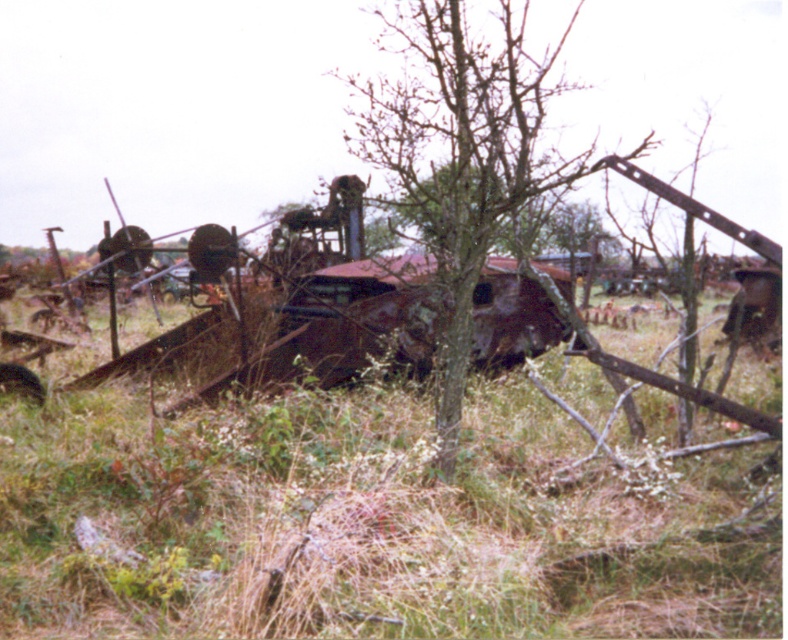
Is green grass at center taller than rusty metal train car at center?

No, green grass at center is not taller than rusty metal train car at center.

Who is more distant from viewer, (768, 621) or (348, 296)?

Point (348, 296)

What do you see at coordinates (363, 522) in the screenshot?
I see `green grass at center` at bounding box center [363, 522].

The width and height of the screenshot is (788, 640). I want to click on green grass at center, so (363, 522).

Describe the element at coordinates (459, 160) in the screenshot. I see `bare wood tree at center` at that location.

Based on the photo, between bare wood tree at center and rusty metal train car at center, which one appears on the left side from the viewer's perspective?

rusty metal train car at center is more to the left.

Does point (459, 186) come behind point (396, 323)?

That is False.

The height and width of the screenshot is (640, 788). I want to click on bare wood tree at center, so (x=459, y=160).

Does green grass at center have a larger size compared to bare wood tree at center?

No, green grass at center is not bigger than bare wood tree at center.

Between green grass at center and bare wood tree at center, which one has less height?

Standing shorter between the two is green grass at center.

What do you see at coordinates (363, 522) in the screenshot? I see `green grass at center` at bounding box center [363, 522].

This screenshot has height=640, width=788. What are the coordinates of `green grass at center` in the screenshot? It's located at (363, 522).